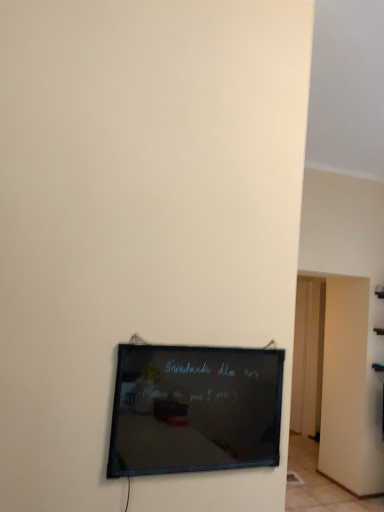
Question: Considering the relative positions of black glass board at lower center and wooden door at right in the image provided, is black glass board at lower center to the left of wooden door at right from the viewer's perspective?

Choices:
 (A) no
 (B) yes

Answer: (B)

Question: Is the depth of black glass board at lower center greater than that of wooden door at right?

Choices:
 (A) no
 (B) yes

Answer: (A)

Question: Can you confirm if black glass board at lower center is shorter than wooden door at right?

Choices:
 (A) yes
 (B) no

Answer: (A)

Question: Is black glass board at lower center at the right side of wooden door at right?

Choices:
 (A) no
 (B) yes

Answer: (A)

Question: Does black glass board at lower center come in front of wooden door at right?

Choices:
 (A) yes
 (B) no

Answer: (A)

Question: Is black glass board at lower center outside wooden door at right?

Choices:
 (A) no
 (B) yes

Answer: (B)

Question: Does wooden door at right lie in front of black glass board at lower center?

Choices:
 (A) no
 (B) yes

Answer: (A)

Question: Does wooden door at right have a smaller size compared to black glass board at lower center?

Choices:
 (A) yes
 (B) no

Answer: (B)

Question: From a real-world perspective, is wooden door at right under black glass board at lower center?

Choices:
 (A) no
 (B) yes

Answer: (B)

Question: Considering the relative sizes of wooden door at right and black glass board at lower center in the image provided, is wooden door at right bigger than black glass board at lower center?

Choices:
 (A) yes
 (B) no

Answer: (A)

Question: Is wooden door at right further to the viewer compared to black glass board at lower center?

Choices:
 (A) yes
 (B) no

Answer: (A)

Question: Can you confirm if wooden door at right is wider than black glass board at lower center?

Choices:
 (A) yes
 (B) no

Answer: (B)

Question: From a real-world perspective, is black glass board at lower center above or below wooden door at right?

Choices:
 (A) above
 (B) below

Answer: (A)